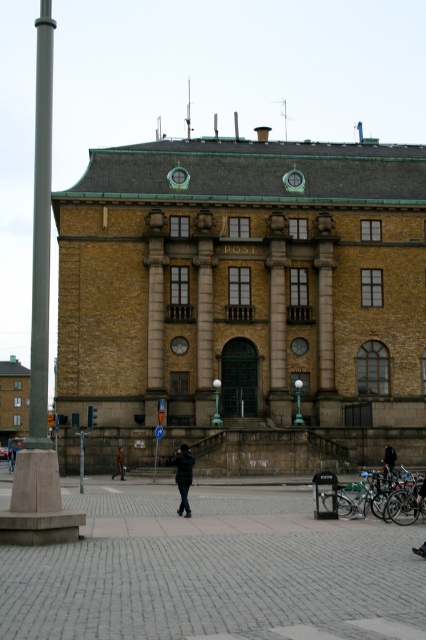
Question: Which is farther from the black leather jacket at center?

Choices:
 (A) green metallic lamp post at center
 (B) black leather jacket at lower center
 (C) smooth gray pole at left

Answer: (C)

Question: Does smooth gray pole at left appear on the right side of black leather jacket at lower center?

Choices:
 (A) no
 (B) yes

Answer: (B)

Question: Can you confirm if dark blue jacket at center is thinner than green glass lamp post at center?

Choices:
 (A) no
 (B) yes

Answer: (A)

Question: From the image, what is the correct spatial relationship of dark blue jacket at center in relation to green metallic lamp post at center?

Choices:
 (A) above
 (B) below

Answer: (B)

Question: Which of the following is the farthest from the observer?

Choices:
 (A) (388, 452)
 (B) (218, 406)

Answer: (B)

Question: Which of the following is the closest to the observer?

Choices:
 (A) green metallic lamp post at center
 (B) dark blue jacket at center

Answer: (B)